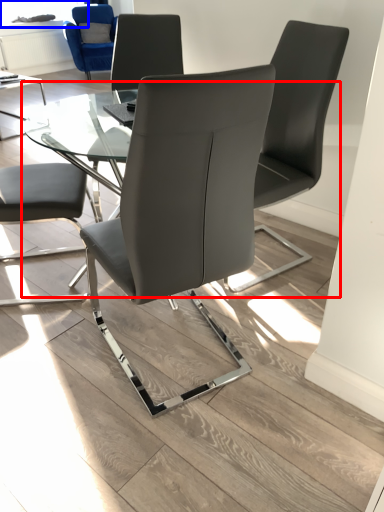
Question: Which object appears farthest to the camera in this image, round table (highlighted by a red box) or window screen (highlighted by a blue box)?

Choices:
 (A) round table
 (B) window screen

Answer: (B)